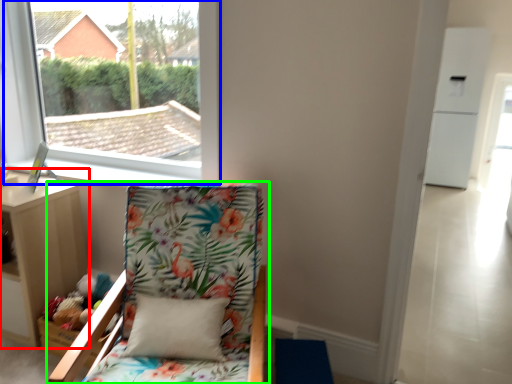
Question: Considering the real-world distances, which object is farthest from nightstand (highlighted by a red box)? window (highlighted by a blue box) or chair (highlighted by a green box)?

Choices:
 (A) window
 (B) chair

Answer: (A)